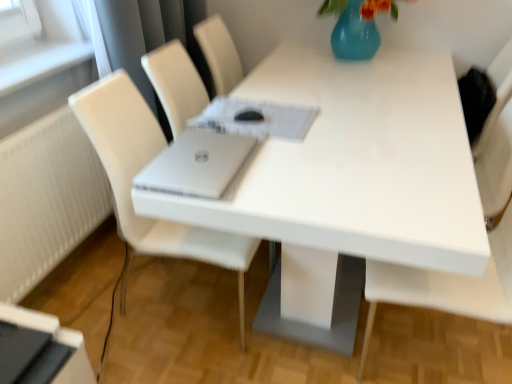
Where is `free space underneath white matte chair at right, which appears as the 1th chair when viewed from the right (from a real-world perspective)`? The width and height of the screenshot is (512, 384). free space underneath white matte chair at right, which appears as the 1th chair when viewed from the right (from a real-world perspective) is located at coordinates (455, 351).